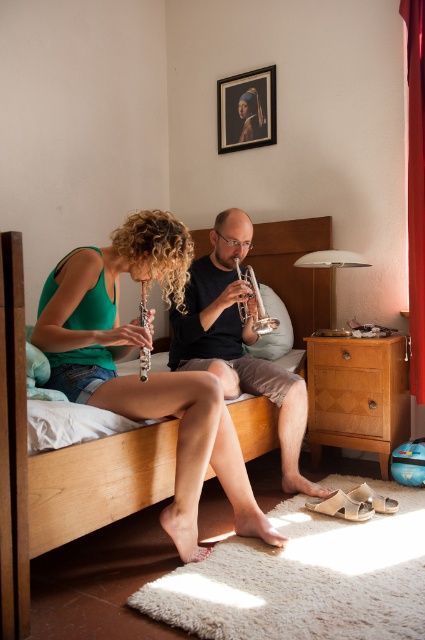
You are standing in the room and need to place a small music stand between the two people on the wooden bed. Where should you position it so that it is closest to the wooden drawer at center right?

The wooden drawer at center right is located at point (348,388), so you should position the music stand near that location to be closest to it.